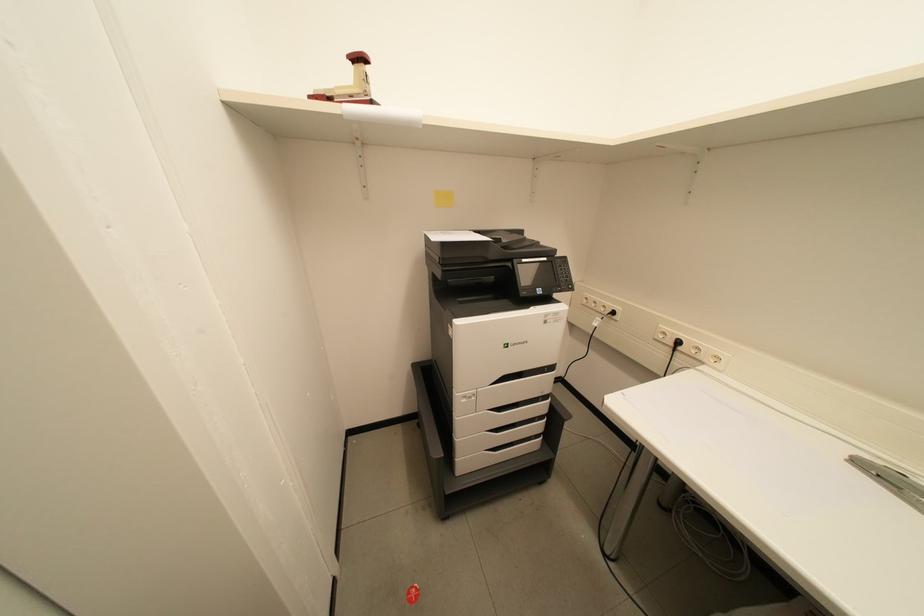
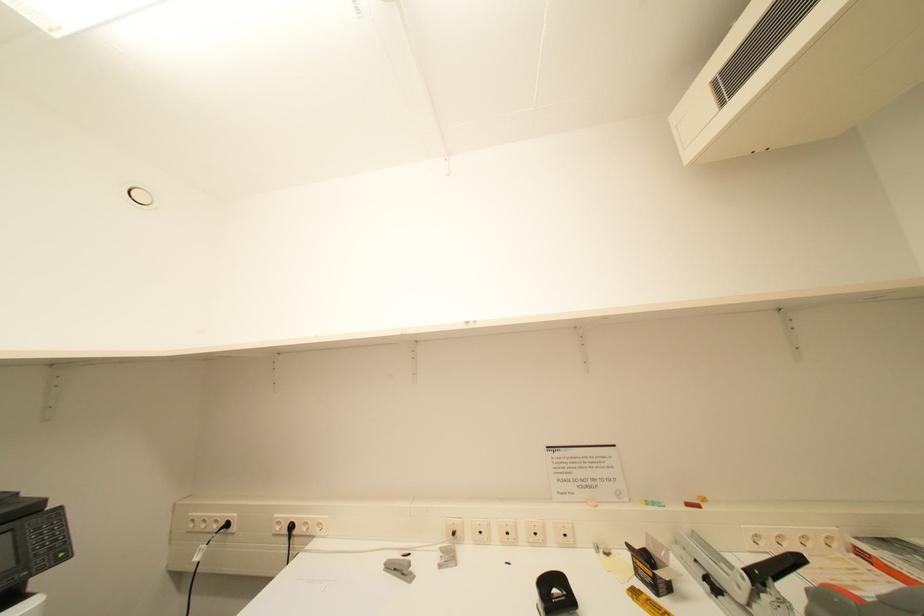
How did the camera likely rotate?

The rotation direction of the camera is right-up.